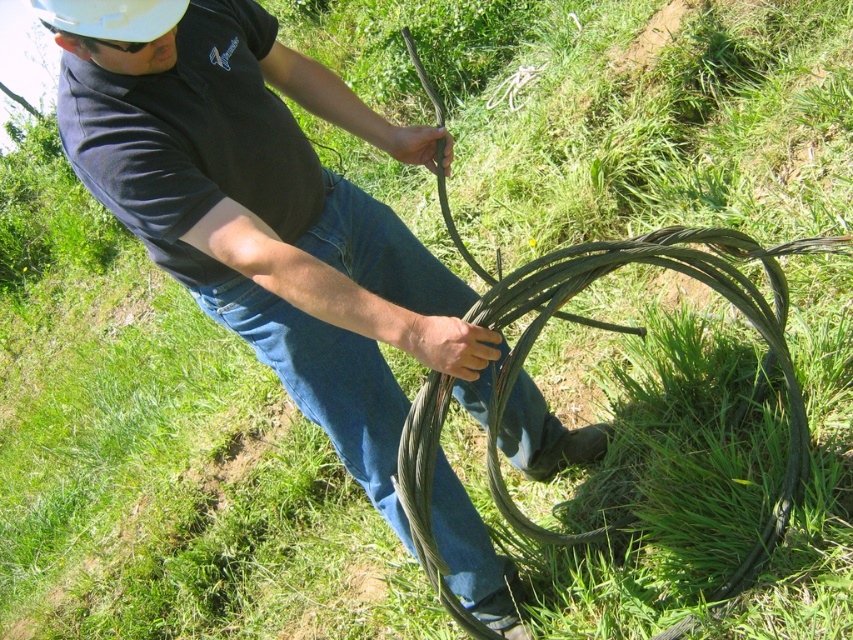
You are a safety inspector checking the work area. You notice the matte black cable at center and the blue denim jeans at center. According to safety protocols, the cable should not be placed in front of the worker. Is the current setup compliant with safety standards?

The matte black cable at center is in front of blue denim jeans at center, which means it is positioned in front of the worker, violating safety protocols. The setup is not compliant with safety standards.

You need to transport both the matte black cable at center and the blue denim jeans at center in a bag that can only hold items smaller than 1 meter in length. Which item might not fit based on their sizes?

The matte black cable at center has a larger size compared to blue denim jeans at center, so it might not fit in the bag.

You are a safety inspector checking the equipment placement in the image. The blue denim jeans at center and white matte hardhat at upper left are both in view. According to safety regulations, the hardhat must be positioned closer to the worker than the jeans. Is the current arrangement compliant?

The blue denim jeans at center are to the right of the white matte hardhat at upper left, meaning the hardhat is positioned closer to the worker than the jeans. This arrangement complies with the safety regulations.